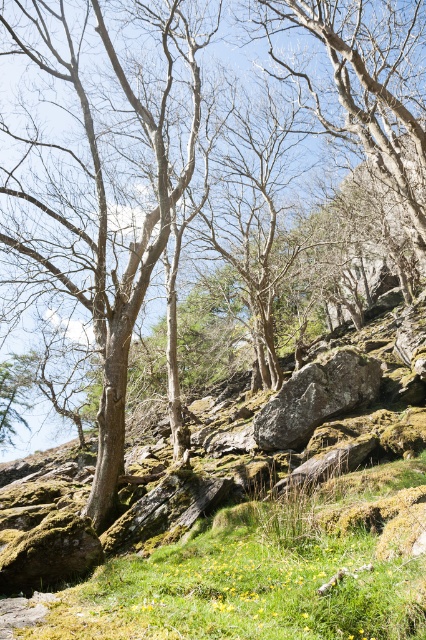
You are a hiker standing at the base of the rocky hillside. You see the rocky mossy boulder at center and the green mossy rock at center. Which one do you have to walk towards first to reach the one farther away?

You must first walk towards the rocky mossy boulder at center because it is in front of the green mossy rock at center, meaning the green mossy rock at center is farther away and requires passing the boulder first.

You are a hiker trying to cross the rocky slope. You see a rocky mossy boulder at center and a green mossy rock at center. Which one do you think is wider?

The rocky mossy boulder at center is wider than the green mossy rock at center.

You are standing at point (x=259, y=538) in the rocky hillside scene. What object is located exactly at your current position?

The rocky mossy boulder at center is located exactly at point (x=259, y=538).